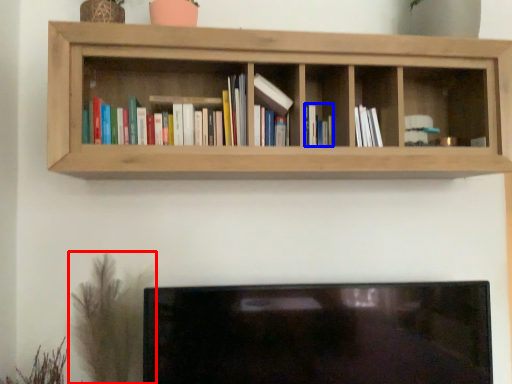
Question: Which of the following is the farthest to the observer, plant (highlighted by a red box) or book (highlighted by a blue box)?

Choices:
 (A) plant
 (B) book

Answer: (B)